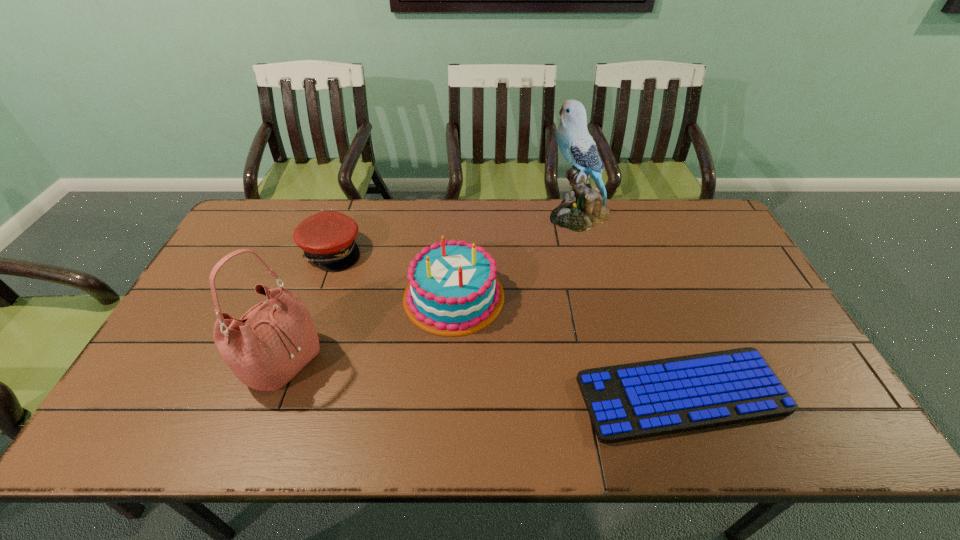
Where is `parakeet`? The height and width of the screenshot is (540, 960). parakeet is located at coordinates (587, 209).

Where is `the fourth shortest object`? The image size is (960, 540). the fourth shortest object is located at coordinates (272, 342).

Where is `birthday cake`? The height and width of the screenshot is (540, 960). birthday cake is located at coordinates (454, 290).

In order to click on the third tallest object in this screenshot , I will do `click(454, 290)`.

The height and width of the screenshot is (540, 960). Find the location of `cap`. cap is located at coordinates (327, 238).

I want to click on computer keyboard, so click(625, 402).

At what (x,y) coordinates should I click in order to perform the action: click on free spot located 0.360m on the face of the parakeet. Please return your answer as a coordinate pair (x, y). Image resolution: width=960 pixels, height=540 pixels. Looking at the image, I should click on (444, 215).

Image resolution: width=960 pixels, height=540 pixels. I want to click on free point located on the face of the parakeet, so click(x=506, y=215).

This screenshot has width=960, height=540. Find the location of `vacant region located on the face of the parakeet`. vacant region located on the face of the parakeet is located at coordinates (449, 215).

The image size is (960, 540). Identify the location of free location located 0.070m on the right of the handbag. (348, 362).